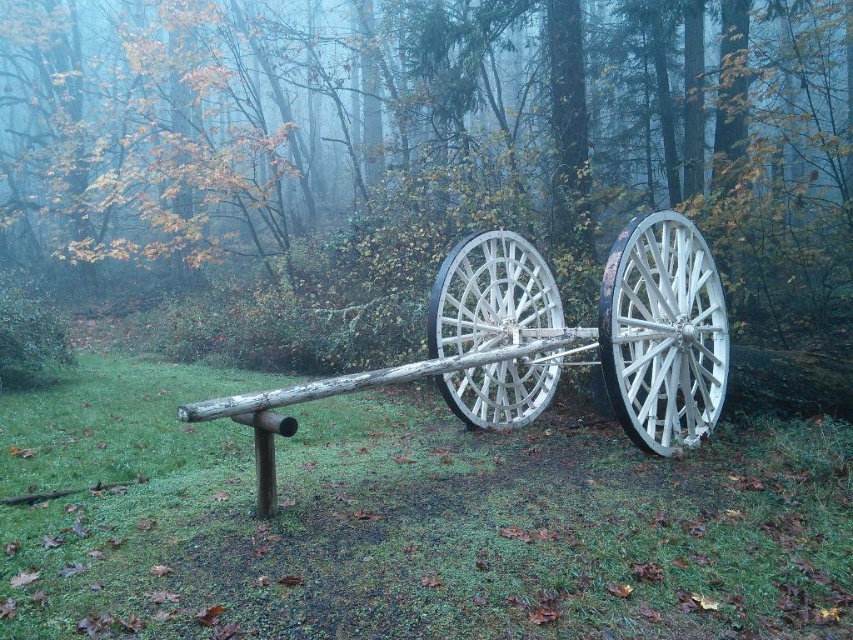
Can you confirm if green matte wood at center is positioned to the right of white wooden wagon wheel at right?

Incorrect, green matte wood at center is not on the right side of white wooden wagon wheel at right.

At what (x,y) coordinates should I click in order to perform the action: click on green matte wood at center. Please return your answer as a coordinate pair (x, y). Image resolution: width=853 pixels, height=640 pixels. Looking at the image, I should click on (431, 160).

Locate an element on the screen. This screenshot has height=640, width=853. green matte wood at center is located at coordinates (431, 160).

Measure the distance between white wooden cart at center and white wooden wagon wheel at right.

They are 89.91 centimeters apart.

Who is positioned more to the left, white wooden cart at center or white wooden wagon wheel at right?

white wooden cart at center

The width and height of the screenshot is (853, 640). Find the location of `white wooden cart at center`. white wooden cart at center is located at coordinates (547, 342).

Locate an element on the screen. This screenshot has height=640, width=853. white wooden cart at center is located at coordinates (547, 342).

At what (x,y) coordinates should I click in order to perform the action: click on green matte wood at center. Please return your answer as a coordinate pair (x, y). Looking at the image, I should click on (431, 160).

Is green matte wood at center below white wooden wheel at center?

Incorrect, green matte wood at center is not positioned below white wooden wheel at center.

Is point (339, 268) positioned in front of point (531, 336)?

No, (339, 268) is behind (531, 336).

The width and height of the screenshot is (853, 640). I want to click on green matte wood at center, so click(x=431, y=160).